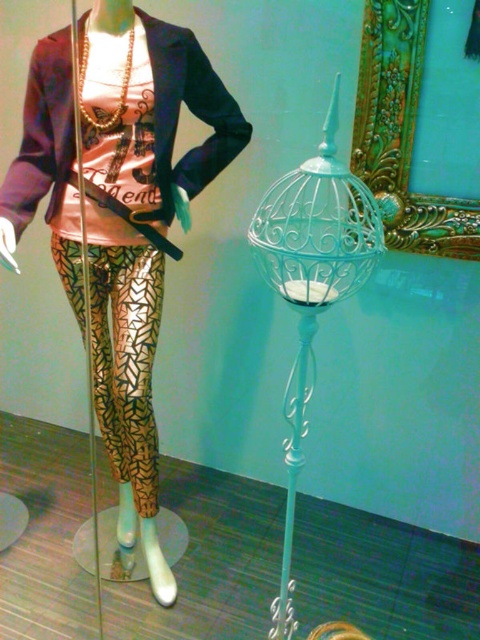
You are a fashion designer trying to decide whether to place a new accessory between the metallic gold pants at center and the white wrought iron lamp at right. Since the accessory requires 30 cm of space, can you determine if there is enough space between them?

The metallic gold pants at center has a larger size compared to white wrought iron lamp at right, but the exact distance between them is not provided. Without knowing the actual spacing, it is impossible to confirm if 30 cm is available. More information is needed.

You are a store manager checking the layout of the store. You need to ensure that the metallic gold pants at center and the white wrought iron lamp at right are placed in a way that the lamp doesn not block the view of the pants. Based on their heights, which object should be placed closer to the entrance so that the other can be seen clearly?

The metallic gold pants at center is taller than the white wrought iron lamp at right. To ensure the lamp does not block the view of the pants, the taller metallic gold pants at center should be placed closer to the entrance, allowing the shorter white wrought iron lamp at right to be seen behind it.